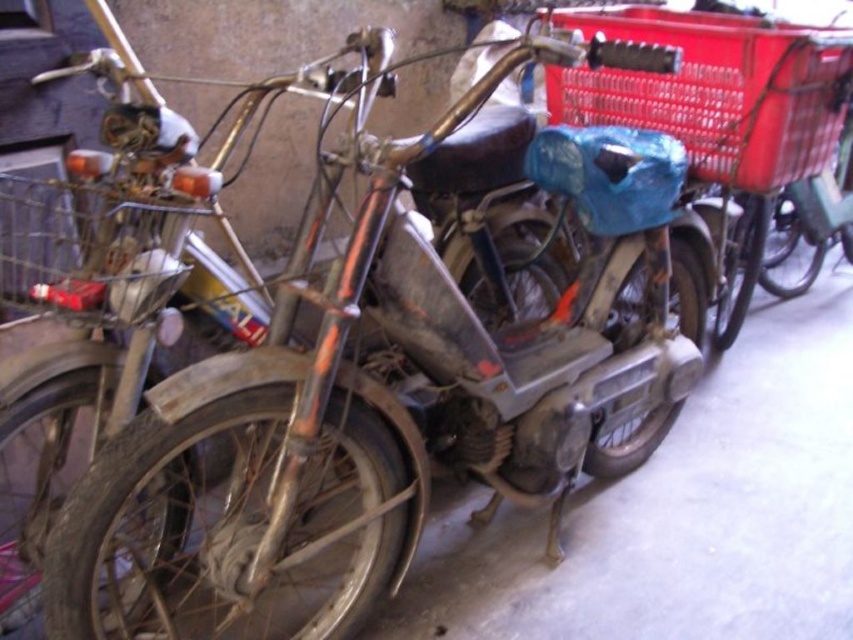
Question: Is red plastic basket at upper right smaller than metallic wire basket at left?

Choices:
 (A) yes
 (B) no

Answer: (B)

Question: Does red plastic basket at upper right have a smaller size compared to metallic wire basket at left?

Choices:
 (A) no
 (B) yes

Answer: (A)

Question: Can you confirm if red plastic basket at upper right is wider than metallic wire basket at left?

Choices:
 (A) yes
 (B) no

Answer: (A)

Question: Which of the following is the closest to the observer?

Choices:
 (A) red plastic basket at upper right
 (B) metallic wire basket at left

Answer: (B)

Question: Which of the following is the farthest from the observer?

Choices:
 (A) red plastic basket at upper right
 (B) metallic wire basket at left

Answer: (A)

Question: Which point is farther from the camera taking this photo?

Choices:
 (A) (120, 209)
 (B) (762, 40)

Answer: (B)